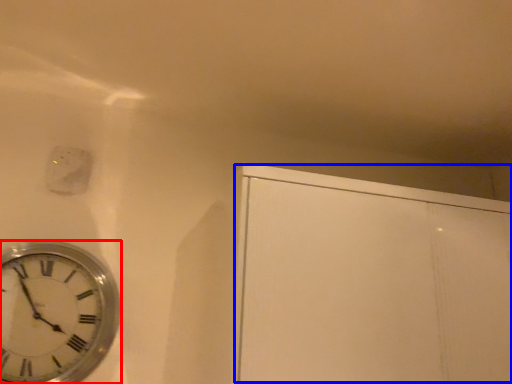
Question: Which object appears closest to the camera in this image, wall clock (highlighted by a red box) or glass door (highlighted by a blue box)?

Choices:
 (A) wall clock
 (B) glass door

Answer: (B)